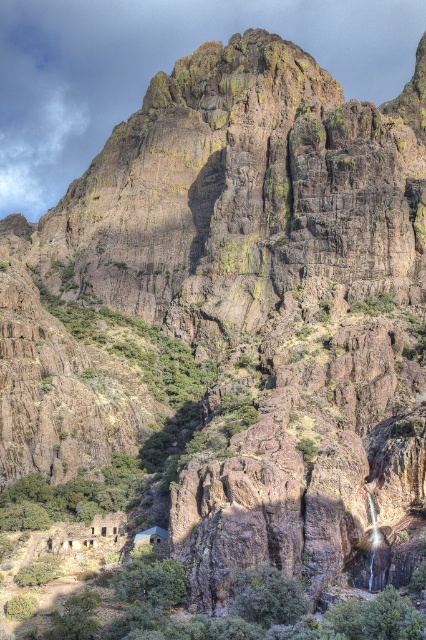
Question: Is green leafy shrubs at lower center wider than rustic stone hut at center?

Choices:
 (A) no
 (B) yes

Answer: (B)

Question: Does green leafy shrubs at lower center have a greater width compared to rustic stone hut at center?

Choices:
 (A) yes
 (B) no

Answer: (A)

Question: Which object is farther from the camera taking this photo?

Choices:
 (A) rustic stone hut at center
 (B) green leafy shrubs at lower center

Answer: (A)

Question: Which point is farther to the camera?

Choices:
 (A) (140, 536)
 (B) (60, 628)

Answer: (A)

Question: Is green leafy shrubs at lower center wider than rustic stone hut at center?

Choices:
 (A) no
 (B) yes

Answer: (B)